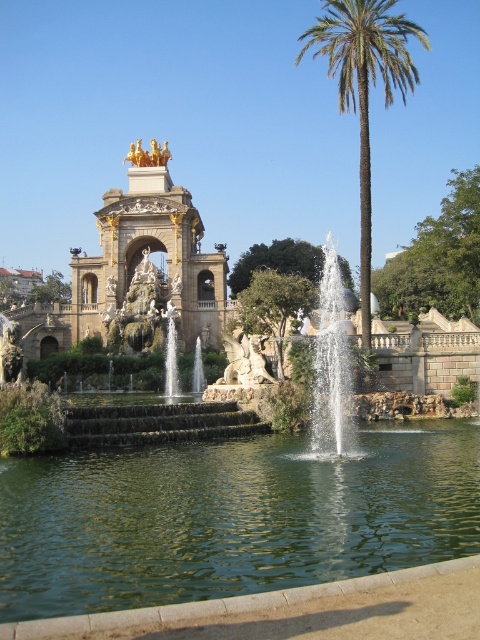
Image resolution: width=480 pixels, height=640 pixels. Describe the element at coordinates (363, 86) in the screenshot. I see `green leafy palm tree at right` at that location.

Between green leafy palm tree at right and clear glass fountain at center, which one is positioned higher?

Positioned higher is green leafy palm tree at right.

The height and width of the screenshot is (640, 480). Identify the location of green leafy palm tree at right. (363, 86).

Is green liquid water at center bigger than green leafy palm tree at right?

Actually, green liquid water at center might be smaller than green leafy palm tree at right.

Where is `green liquid water at center`? green liquid water at center is located at coordinates tap(230, 516).

Does green liquid water at center have a lesser width compared to clear glass fountain at center?

No, green liquid water at center is not thinner than clear glass fountain at center.

Who is lower down, green liquid water at center or clear glass fountain at center?

green liquid water at center is lower down.

Is point (48, 563) farther from camera compared to point (320, 433)?

No, (48, 563) is in front of (320, 433).

The width and height of the screenshot is (480, 640). Find the location of `green liquid water at center`. green liquid water at center is located at coordinates (230, 516).